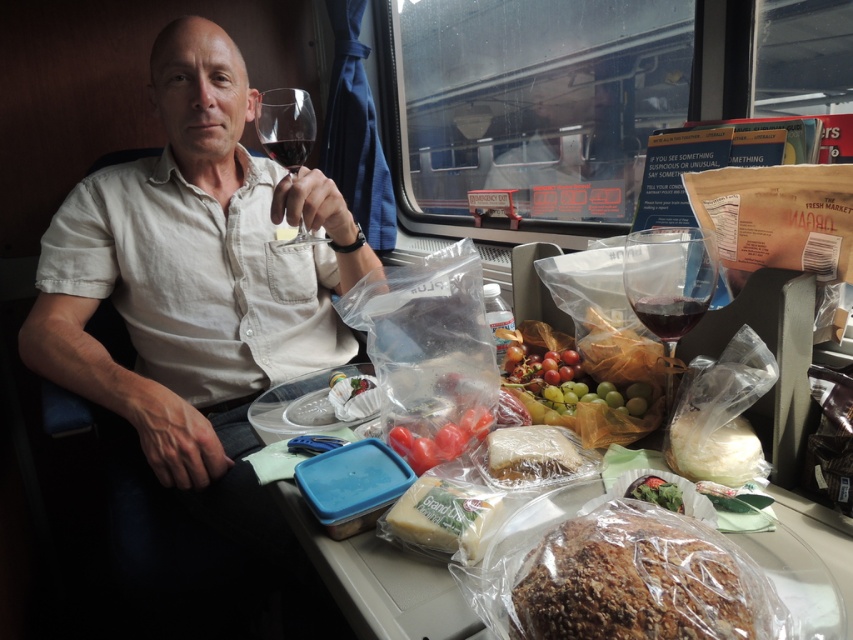
You are a food inspector checking the arrangement of items on a train table. You notice the brown crumbly bread at center and the translucent plastic bag at center. Which item is located to the right of the other?

The brown crumbly bread at center is positioned on the right side of translucent plastic bag at center, so the bread is to the right of the bag.

You are a photographer trying to capture the man in the image. You want to focus on the matte white shirt at upper left and the transparent glass at center. Which object should you adjust your camera to be closer to first if you want to photograph both in one frame?

The matte white shirt at upper left is to the left of the transparent glass at center, so you should adjust your camera closer to the matte white shirt at upper left first to ensure both objects are in frame.

You are a food delivery person who needs to place a brown crumbly bread at center and a translucent plastic bag at center into a delivery box. The box has a maximum width of 8 inches. Can both items fit side by side in the box without overlapping?

The brown crumbly bread at center and the translucent plastic bag at center are 7.61 inches apart from each other, so they can fit side by side in the box since the combined width is less than the box maximum width of 8 inches.